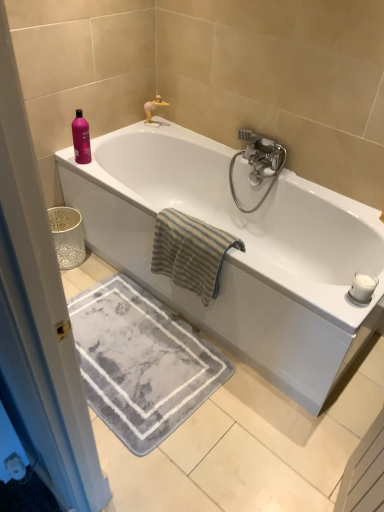
This screenshot has height=512, width=384. Find the location of `vacant area in front of silver metallic faucet at upper center`. vacant area in front of silver metallic faucet at upper center is located at coordinates (166, 131).